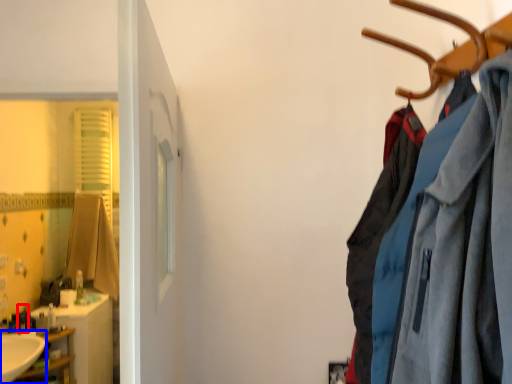
Question: Which of the following is the closest to the observer, toiletry (highlighted by a red box) or sink (highlighted by a blue box)?

Choices:
 (A) toiletry
 (B) sink

Answer: (B)